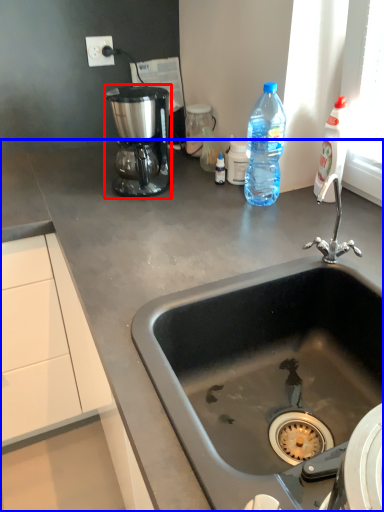
Question: Which point is further to the camera, coffee maker (highlighted by a red box) or countertop (highlighted by a blue box)?

Choices:
 (A) coffee maker
 (B) countertop

Answer: (A)